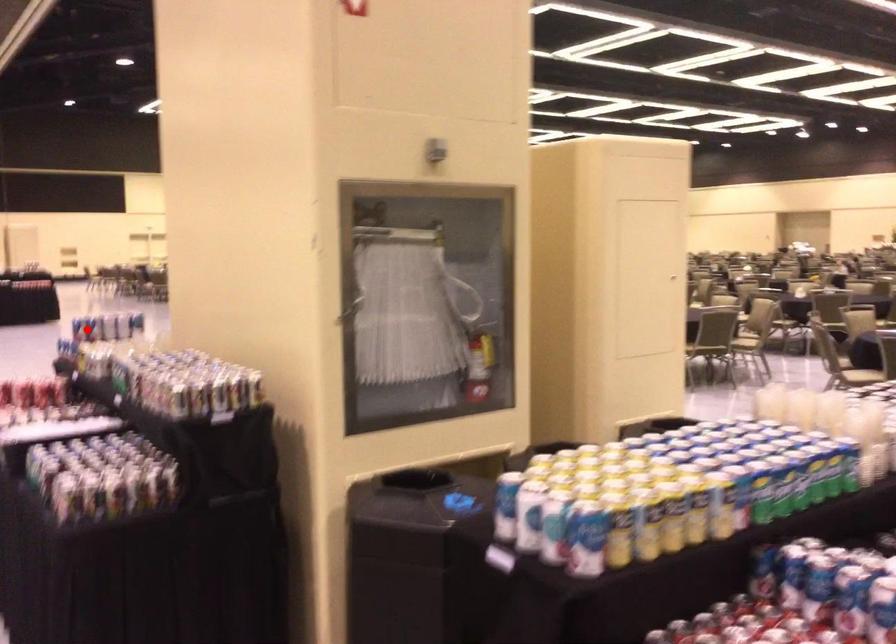
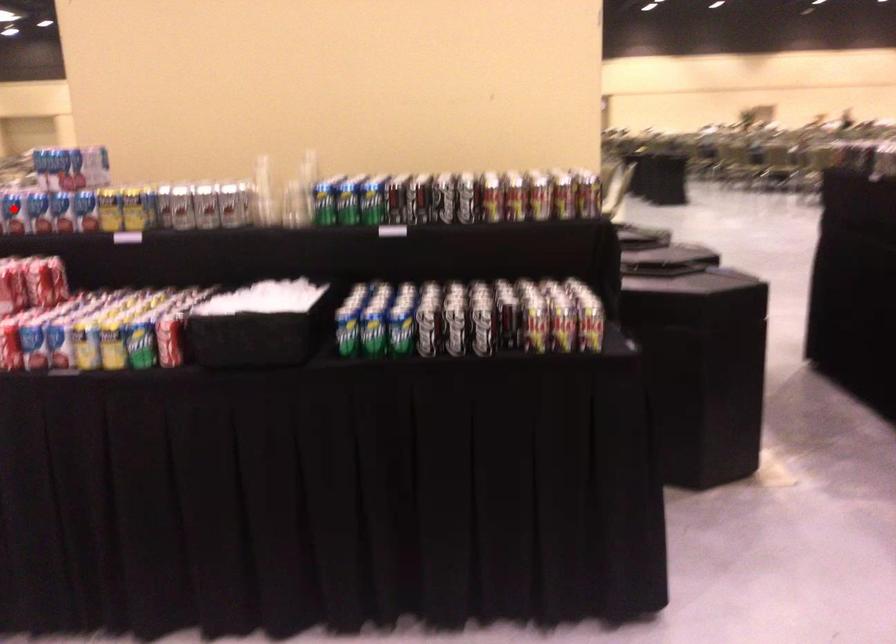
I am providing you with two images of the same scene from different viewpoints. A red point is marked on the first image and another point is marked on the second image. Do the highlighted points in image1 and image2 indicate the same real-world spot?

No